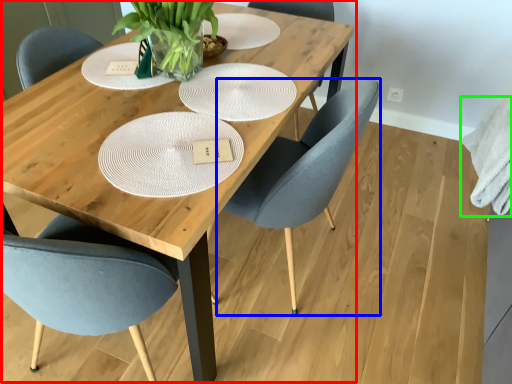
Question: Estimate the real-world distances between objects in this image. Which object is farther from table (highlighted by a red box), chair (highlighted by a blue box) or cloth (highlighted by a green box)?

Choices:
 (A) chair
 (B) cloth

Answer: (B)